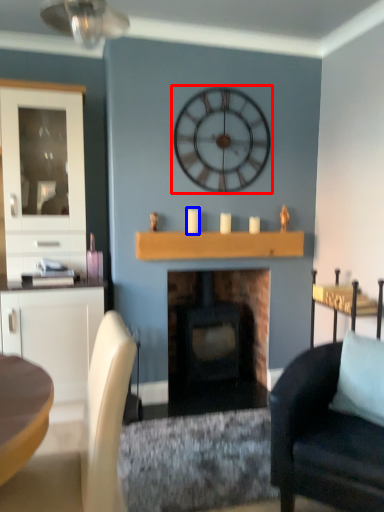
Question: Which point is further to the camera, wall clock (highlighted by a red box) or candle (highlighted by a blue box)?

Choices:
 (A) wall clock
 (B) candle

Answer: (B)